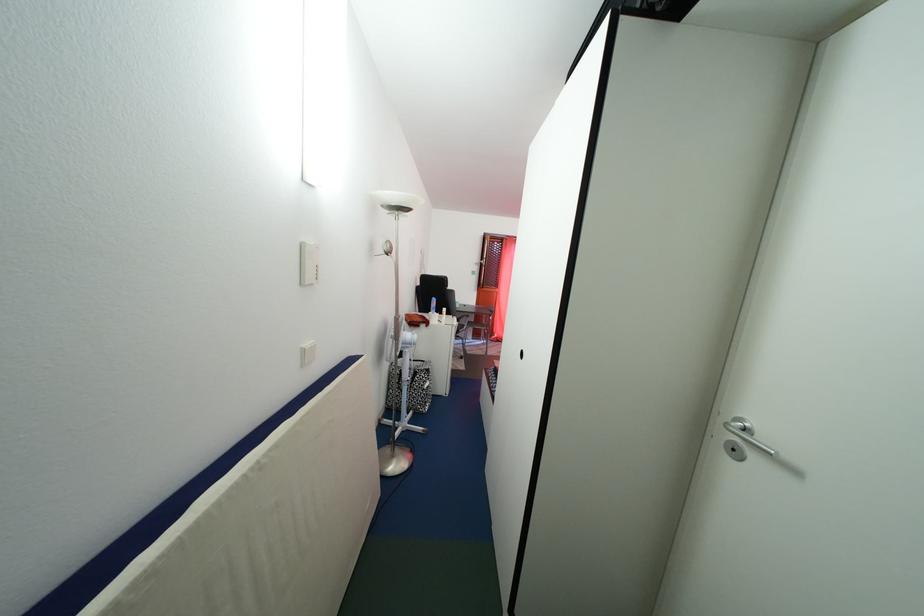
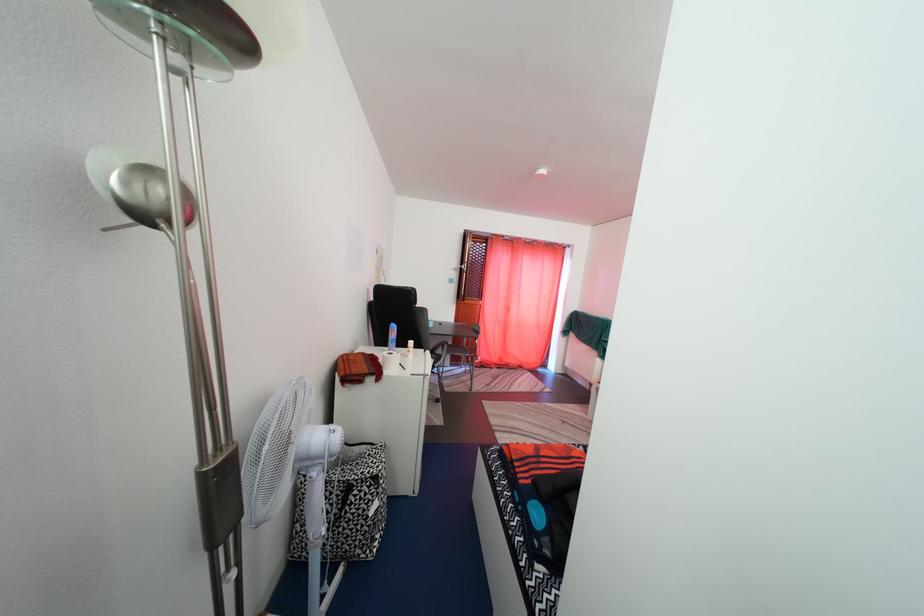
Locate, in the second image, the point that corresponds to point (491, 265) in the first image.

(470, 270)